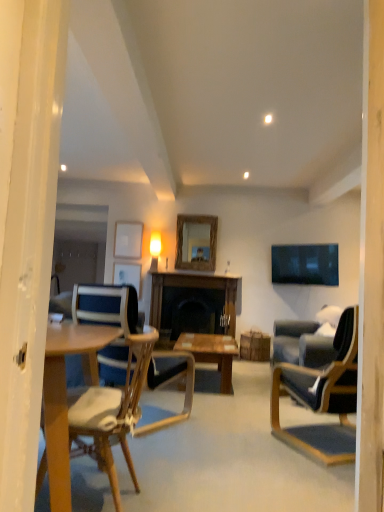
In order to click on vacant space underneath dark gray fabric chair at right, placed as the 2th chair when sorted from left to right (from a real-world perspective) in this screenshot , I will do `click(331, 441)`.